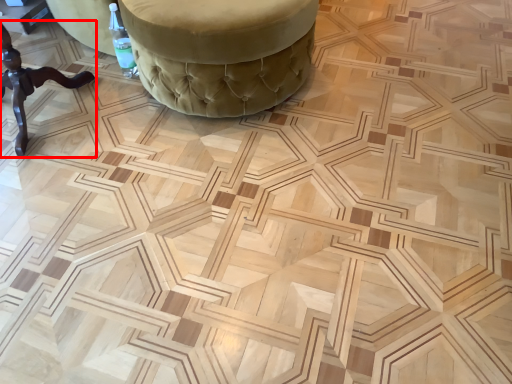
Question: Where is furniture (annotated by the red box) located in relation to furniture in the image?

Choices:
 (A) left
 (B) right

Answer: (A)